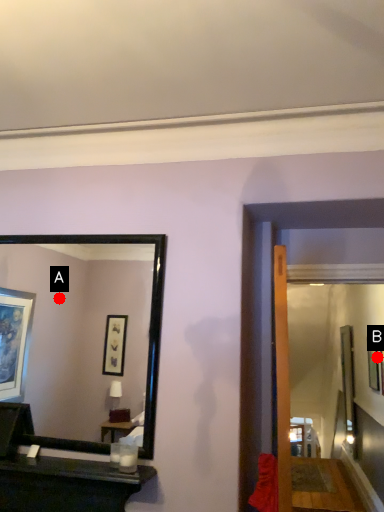
Question: Two points are circled on the image, labeled by A and B beside each circle. Which point is farther to the camera?

Choices:
 (A) A is further
 (B) B is further

Answer: (A)